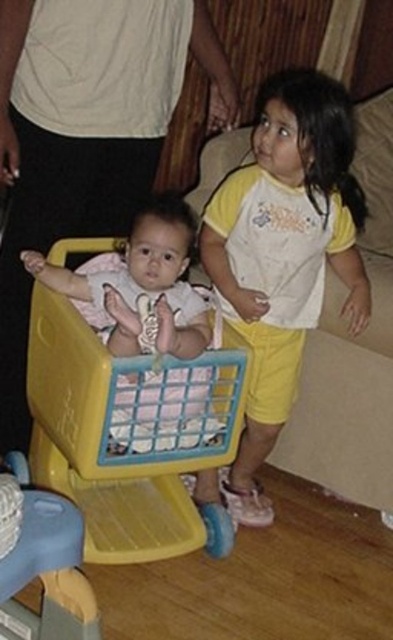
Is yellow cotton shorts at center positioned behind yellow plastic shopping cart at center?

Yes, yellow cotton shorts at center is further from the viewer.

Describe the element at coordinates (284, 253) in the screenshot. I see `yellow cotton shorts at center` at that location.

The image size is (393, 640). Identify the location of yellow cotton shorts at center. (284, 253).

Is point (27, 417) farther from camera compared to point (251, 200)?

Yes, point (27, 417) is farther from viewer.

Is point (102, 211) closer to viewer compared to point (290, 312)?

No, (102, 211) is further to viewer.

You are a GUI agent. You are given a task and a screenshot of the screen. Output one action in this format:
    pyautogui.click(x=<x>, y=<y>)
    Task: Click on the white fabric shirt at upper center
    
    Given the screenshot: What is the action you would take?
    (84, 134)

Looking at this image, is white fabric shirt at upper center to the right of yellow plastic shopping cart at center from the viewer's perspective?

Incorrect, white fabric shirt at upper center is not on the right side of yellow plastic shopping cart at center.

Can you confirm if white fabric shirt at upper center is bigger than yellow plastic shopping cart at center?

Correct, white fabric shirt at upper center is larger in size than yellow plastic shopping cart at center.

Is point (214, 52) in front of point (99, 454)?

No.

The image size is (393, 640). What are the coordinates of `white fabric shirt at upper center` in the screenshot? It's located at (84, 134).